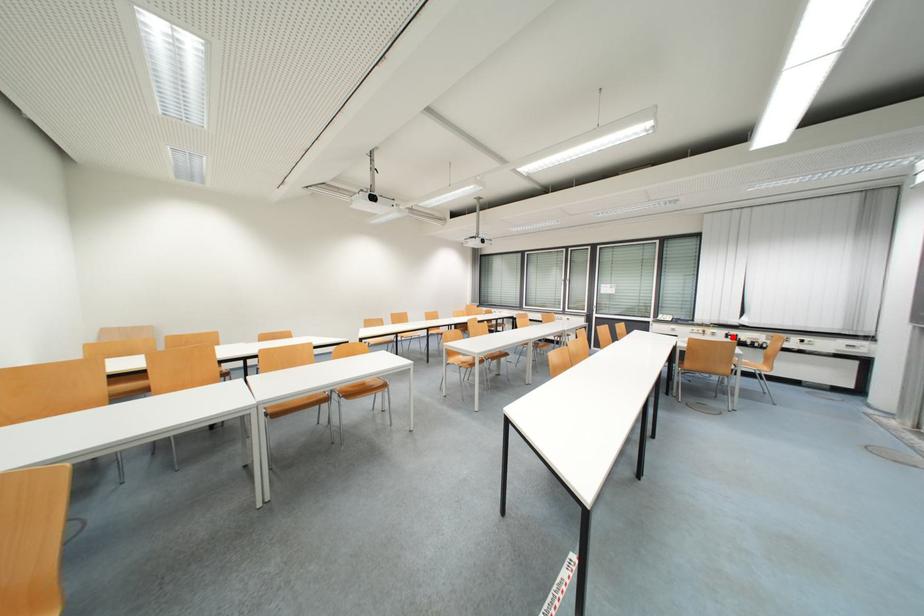
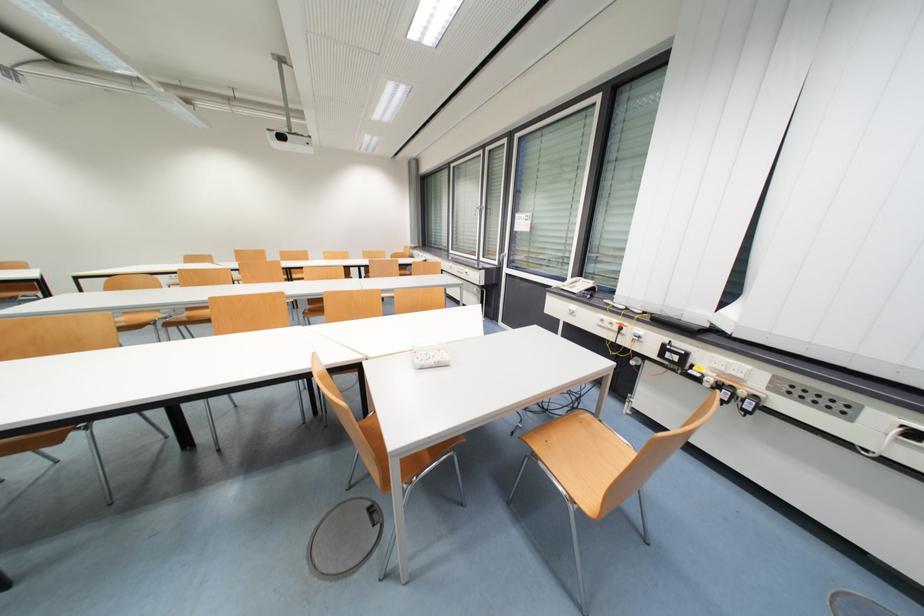
Find the pixel in the second image that matches the highlighted location in the first image.

(671, 350)